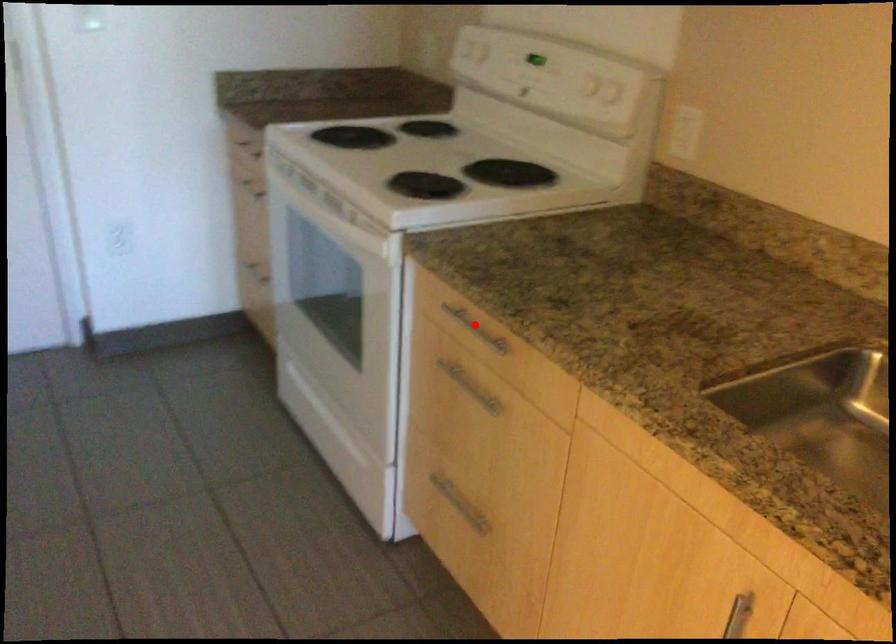
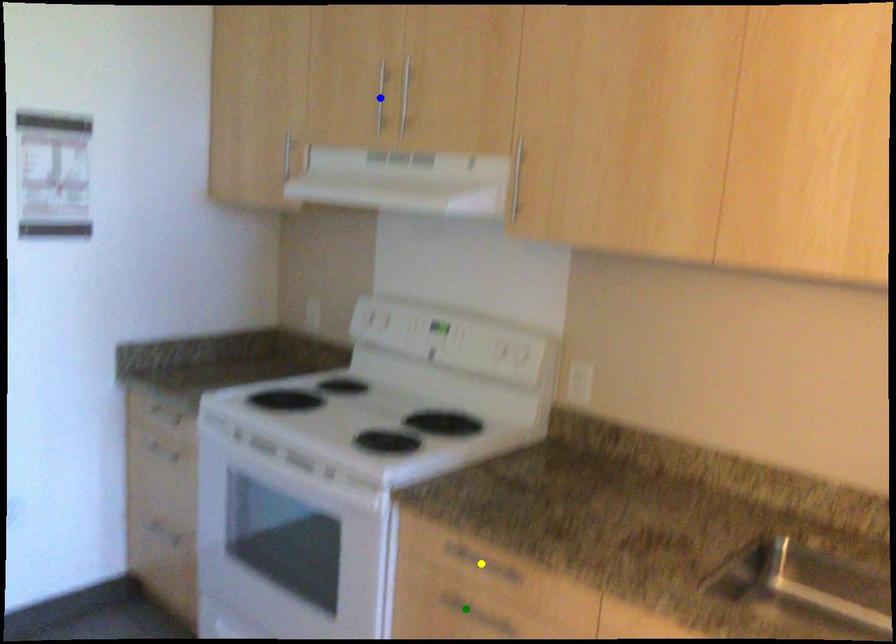
Question: I am providing you with two images of the same scene from different viewpoints. A red point is marked on the first image. You are given multiple points on the second image. Which mark in image 2 goes with the point in image 1?

Choices:
 (A) blue point
 (B) green point
 (C) yellow point

Answer: (C)